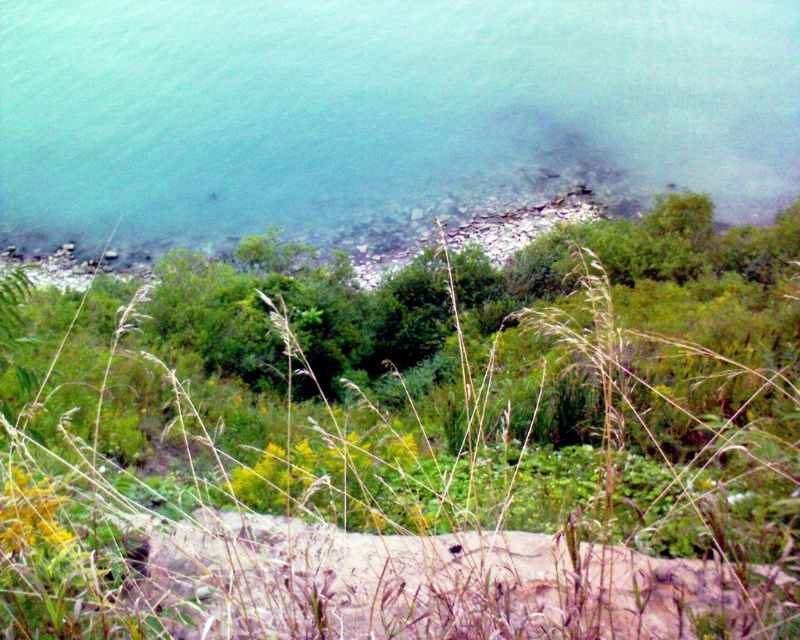
You are standing on the sandy area and want to reach the water. The green grass at center is in your way. Can you step over it?

The green grass at center is 2.67 meters from viewer, so yes, you can step over it since it is within a reasonable distance for a person to step over.

You are planning to build a small wooden walkway that is 20 meters long between the green grass at center and the clear water at lower left. Based on the scene description, will the walkway fit without extending beyond the visible area?

The distance between the green grass at center and the clear water at lower left is 18.74 meters. Since the walkway is 20 meters long, it will extend 1.26 meters beyond the visible area.

You are a photographer aiming to capture the clear water at lower left in focus while keeping the green grass at center visible but slightly out of focus. Based on the scene description, is this achievable?

Yes, because the green grass at center is in front of clear water at lower left, adjusting the camera focus to the clear water at lower left and using a shallow depth of field can keep the green grass at center slightly out of focus while the clear water at lower left remains sharp.